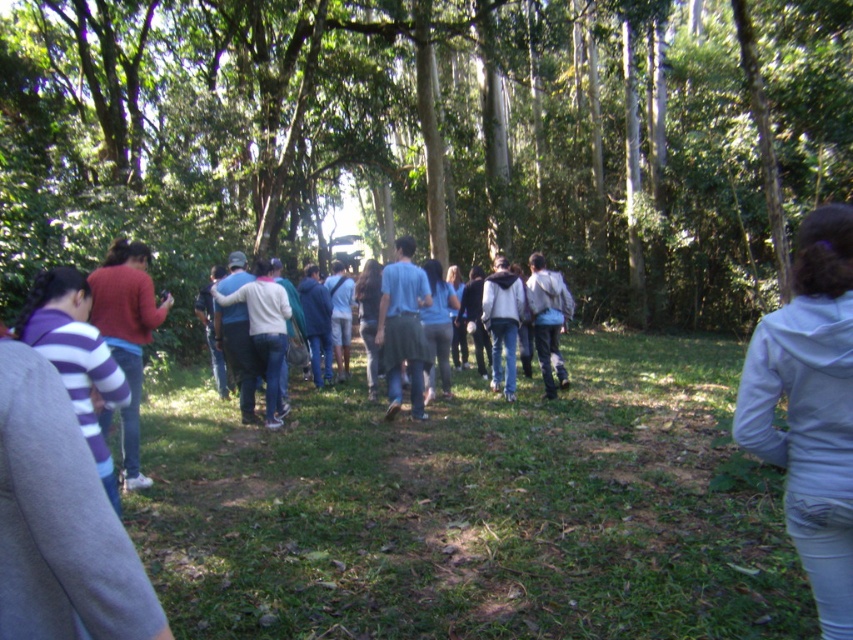
Does green leafy tree at center have a lesser height compared to matte red sweater at left?

Incorrect, green leafy tree at center's height does not fall short of matte red sweater at left's.

Is green leafy tree at center in front of matte red sweater at left?

No, it is behind matte red sweater at left.

At what (x,y) coordinates should I click in order to perform the action: click on green leafy tree at center. Please return your answer as a coordinate pair (x, y). The height and width of the screenshot is (640, 853). Looking at the image, I should click on (432, 138).

Is green grass at center shorter than light gray hoodie at lower right?

Correct, green grass at center is not as tall as light gray hoodie at lower right.

Is green grass at center smaller than light gray hoodie at lower right?

Incorrect, green grass at center is not smaller in size than light gray hoodie at lower right.

Is point (723, 432) farther from camera compared to point (792, 387)?

Yes, point (723, 432) is farther from viewer.

Identify the location of green grass at center. (476, 509).

Does matte red sweater at left have a lesser height compared to denim jacket at center?

In fact, matte red sweater at left may be taller than denim jacket at center.

Who is shorter, matte red sweater at left or denim jacket at center?

denim jacket at center is shorter.

Is point (140, 481) positioned in front of point (387, 349)?

Yes, point (140, 481) is closer to viewer.

Where is `matte red sweater at left`? The image size is (853, 640). matte red sweater at left is located at coordinates (126, 333).